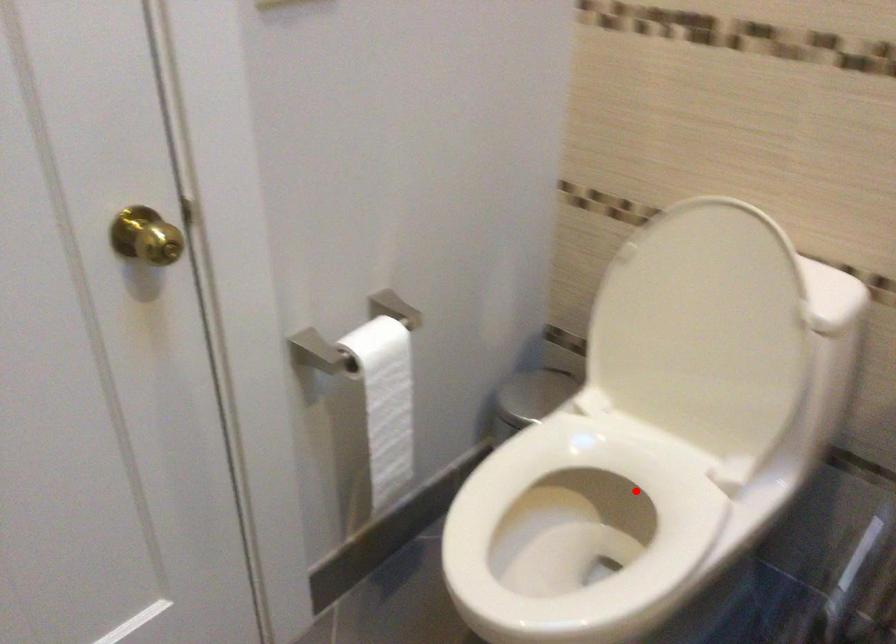
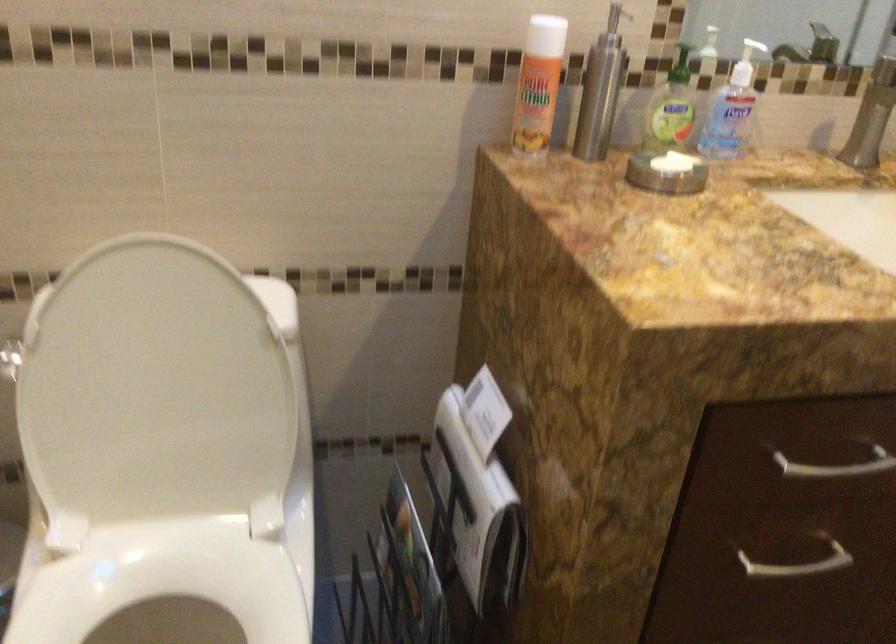
Question: I am providing you with two images of the same scene from different viewpoints. Given a red point in image1, look at the same physical point in image2. Is it:

Choices:
 (A) Closer to the viewpoint
 (B) Farther from the viewpoint

Answer: (A)